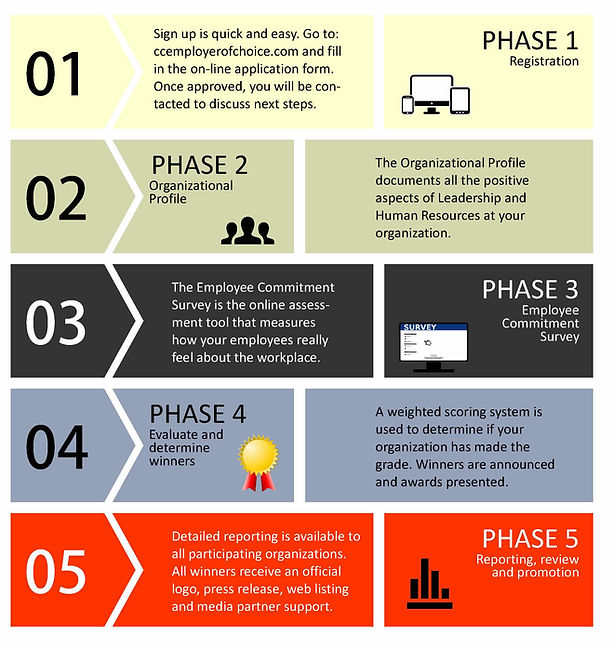
The image size is (613, 650). In order to click on award in this screenshot , I will do `click(256, 452)`.